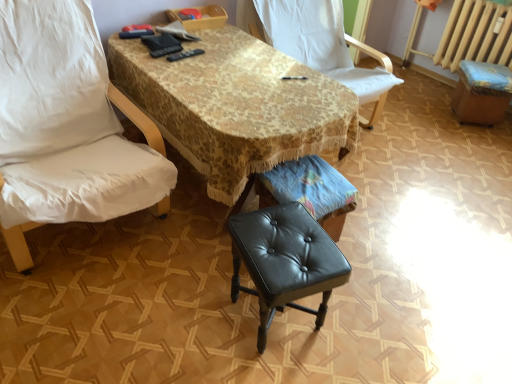
Where is `blank space to the left of black leather music stool at center`? Image resolution: width=512 pixels, height=384 pixels. blank space to the left of black leather music stool at center is located at coordinates (216, 245).